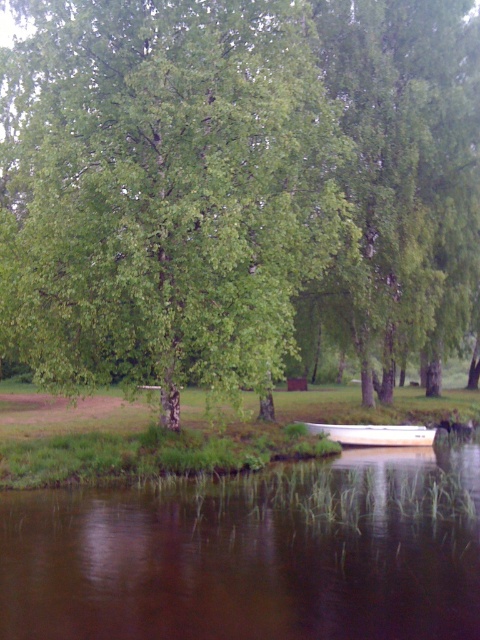
You are standing at the edge of the water and want to take a photo of both point (167, 42) and point (228, 486) in the scene. Which point is closer to your camera lens?

Point (167, 42) is further to the camera than point (228, 486), so the point closer to your camera lens is point (167, 42).

You are a kayaker who wants to launch your kayak from the shore. You see the brown murky water at lower center and the white plastic boat at lower center. Which object is lower in height?

The brown murky water at lower center is not as tall as the white plastic boat at lower center, so the brown murky water at lower center is lower in height.